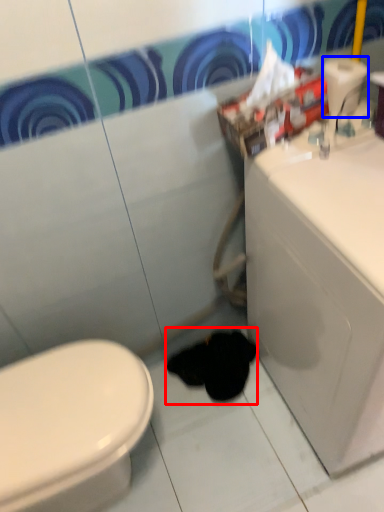
Question: Which of the following is the farthest to the observer, animal (highlighted by a red box) or toilet paper (highlighted by a blue box)?

Choices:
 (A) animal
 (B) toilet paper

Answer: (A)